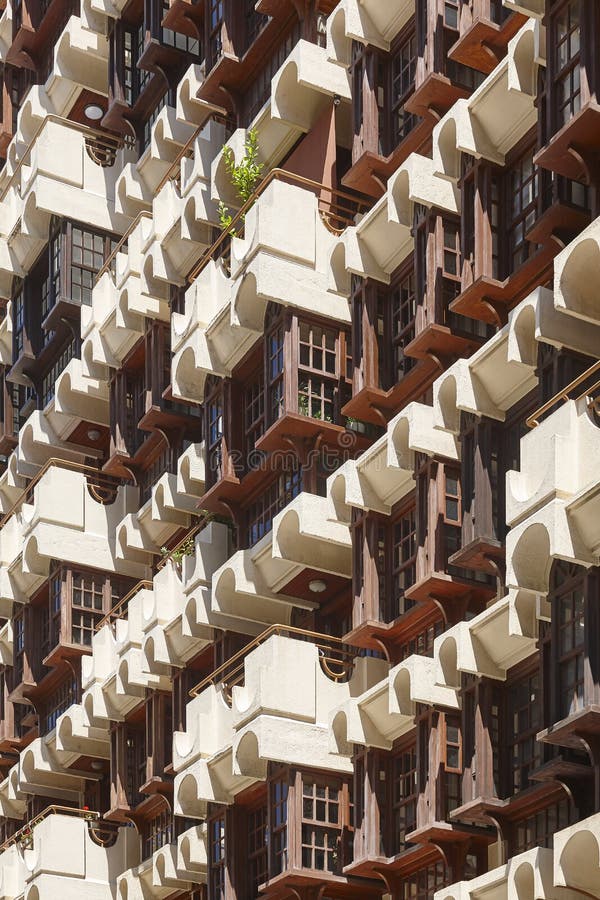
Find the location of a particular element. The image size is (600, 900). windows is located at coordinates (319, 823), (281, 837), (78, 609), (57, 617), (156, 834), (402, 544), (335, 398), (275, 399), (75, 271).